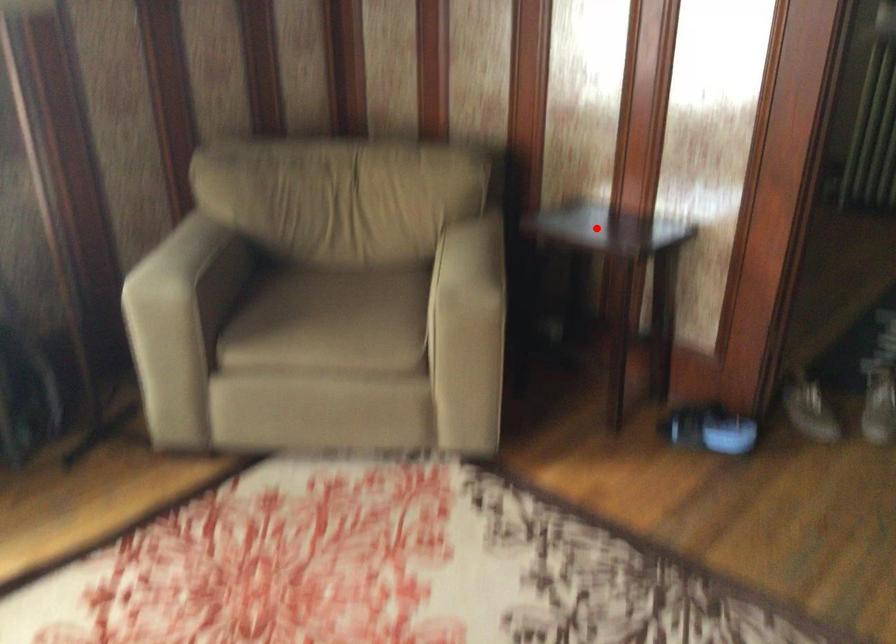
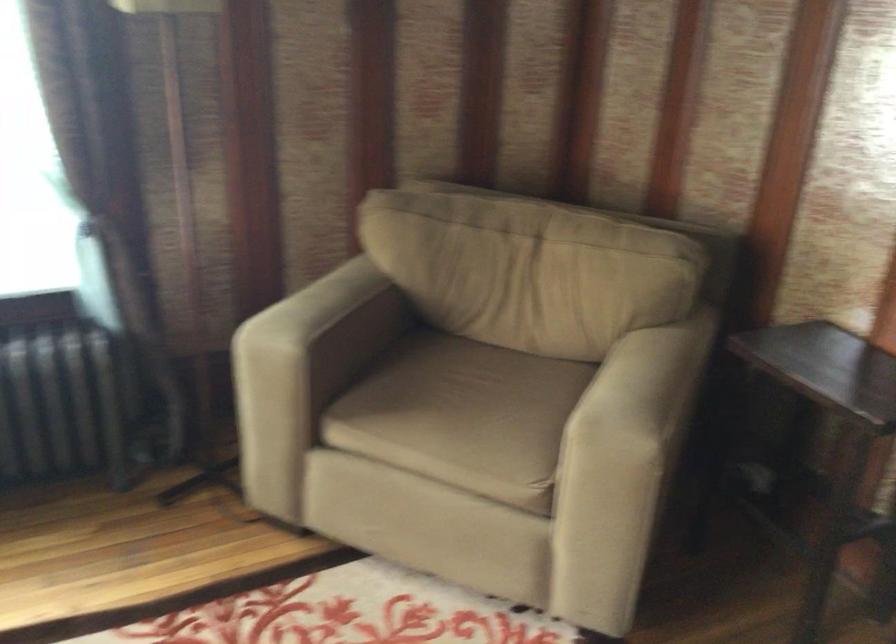
Find the pixel in the second image that matches the highlighted location in the first image.

(826, 368)